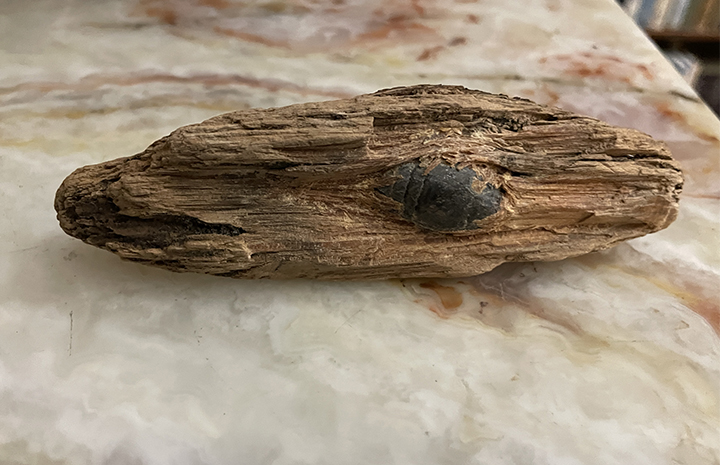
Where is `books`? books is located at coordinates pyautogui.click(x=696, y=19), pyautogui.click(x=698, y=55).